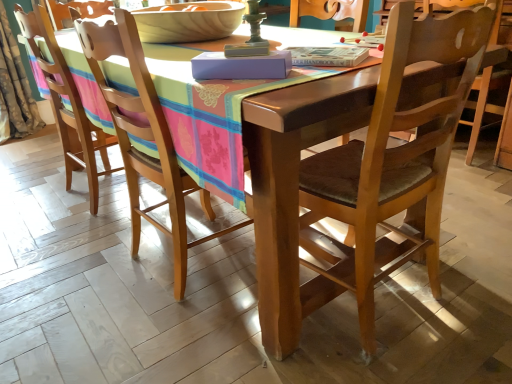
Question: Which direction should I rotate to look at wooden chair at center, which is counted as the 1th chair, starting from the right, — up or down?

Choices:
 (A) up
 (B) down

Answer: (A)

Question: Should I look upward or downward to see wooden chair at center, positioned as the first chair in left-to-right order?

Choices:
 (A) up
 (B) down

Answer: (A)

Question: Does wooden chair at center, which is counted as the third chair, starting from the left, have a smaller size compared to wooden bowl at upper center?

Choices:
 (A) no
 (B) yes

Answer: (A)

Question: Is wooden chair at center, which is counted as the third chair, starting from the left, at the right side of wooden bowl at upper center?

Choices:
 (A) no
 (B) yes

Answer: (B)

Question: Considering the relative sizes of wooden chair at center, which is counted as the third chair, starting from the left, and wooden bowl at upper center in the image provided, is wooden chair at center, which is counted as the third chair, starting from the left, bigger than wooden bowl at upper center?

Choices:
 (A) no
 (B) yes

Answer: (B)

Question: Is wooden chair at center, which is counted as the 1th chair, starting from the right, looking in the opposite direction of wooden bowl at upper center?

Choices:
 (A) yes
 (B) no

Answer: (B)

Question: Could you tell me if wooden chair at center, which is counted as the 1th chair, starting from the right, is turned towards wooden bowl at upper center?

Choices:
 (A) no
 (B) yes

Answer: (B)

Question: Is wooden chair at center, which is counted as the 1th chair, starting from the right, positioned beyond the bounds of wooden bowl at upper center?

Choices:
 (A) yes
 (B) no

Answer: (A)

Question: Is wooden bowl at upper center behind camouflage fabric curtain at left?

Choices:
 (A) no
 (B) yes

Answer: (A)

Question: Does wooden bowl at upper center contain camouflage fabric curtain at left?

Choices:
 (A) yes
 (B) no

Answer: (B)

Question: Considering the relative positions of wooden bowl at upper center and camouflage fabric curtain at left in the image provided, is wooden bowl at upper center in front of camouflage fabric curtain at left?

Choices:
 (A) yes
 (B) no

Answer: (A)

Question: Is wooden bowl at upper center to the right of camouflage fabric curtain at left from the viewer's perspective?

Choices:
 (A) yes
 (B) no

Answer: (A)

Question: Is wooden bowl at upper center oriented towards camouflage fabric curtain at left?

Choices:
 (A) no
 (B) yes

Answer: (A)

Question: From the image's perspective, is wooden bowl at upper center on camouflage fabric curtain at left?

Choices:
 (A) yes
 (B) no

Answer: (B)

Question: Is wooden chair at center, which ranks as the 3th chair in right-to-left order, oriented towards wooden chair at left, arranged as the second chair when viewed from the left?

Choices:
 (A) no
 (B) yes

Answer: (A)